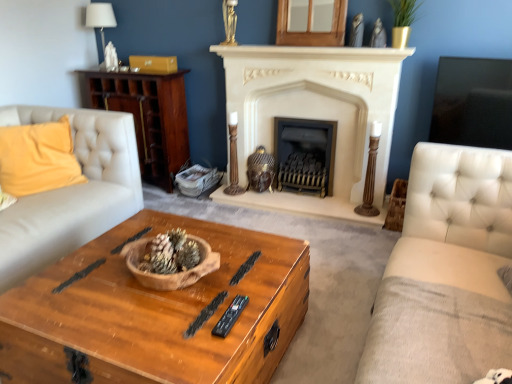
The image size is (512, 384). I want to click on vacant region to the right of black plastic remote at center, so click(x=257, y=305).